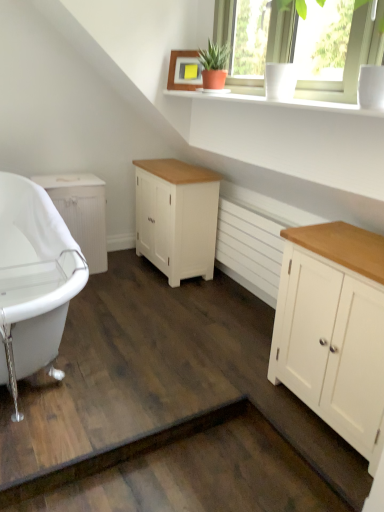
What are the coordinates of `vacant area that is in front of white matte radiator at center` in the screenshot? It's located at coord(220,334).